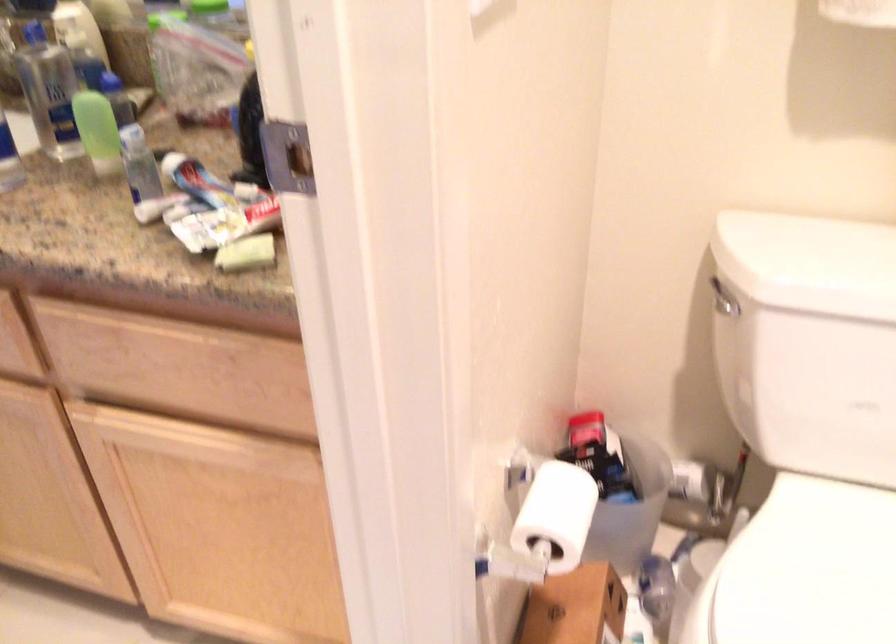
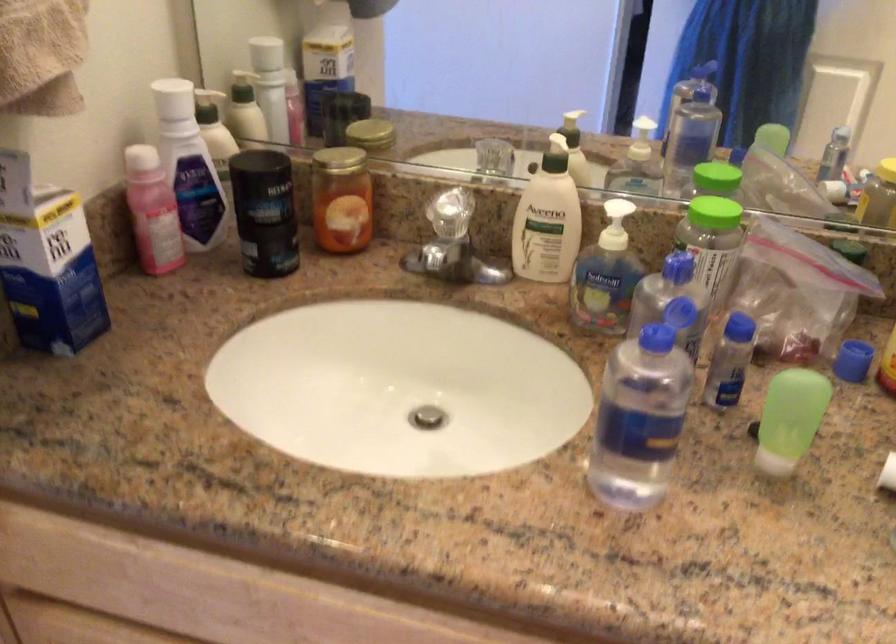
Which direction would the cameraman need to move to produce the second image?

The cameraman walked toward left, forward.